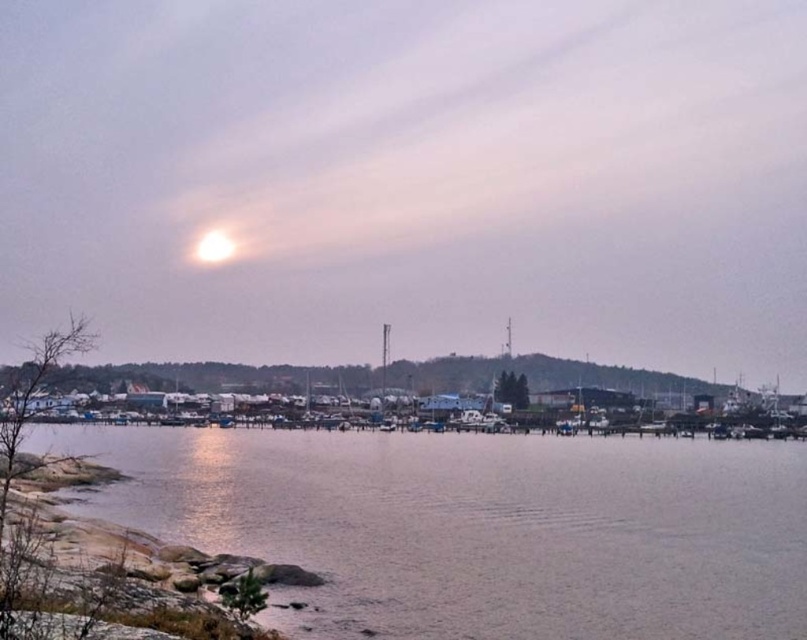
Question: Does smooth water at lower center appear over bright white orb at upper center?

Choices:
 (A) no
 (B) yes

Answer: (A)

Question: Can you confirm if smooth water at lower center is positioned to the left of bright white orb at upper center?

Choices:
 (A) yes
 (B) no

Answer: (B)

Question: Which point is closer to the camera?

Choices:
 (A) (218, 256)
 (B) (734, 611)

Answer: (B)

Question: Which point is farther to the camera?

Choices:
 (A) smooth water at lower center
 (B) bright white orb at upper center

Answer: (B)

Question: Which point is farther from the camera taking this photo?

Choices:
 (A) (214, 230)
 (B) (759, 522)

Answer: (A)

Question: Can you confirm if smooth water at lower center is smaller than bright white orb at upper center?

Choices:
 (A) yes
 (B) no

Answer: (B)